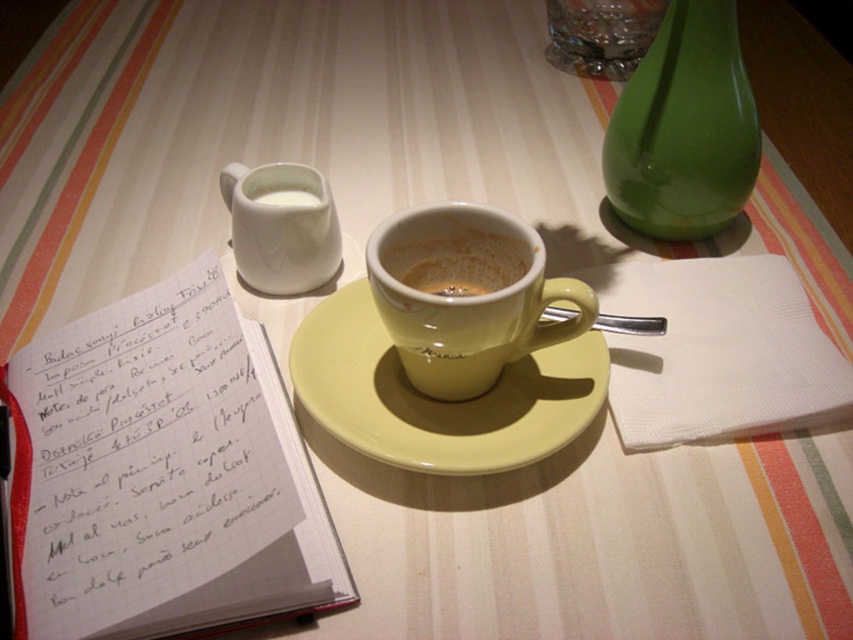
Is red cover notebook at left above white paper napkin at upper right?

Incorrect, red cover notebook at left is not positioned above white paper napkin at upper right.

Describe the element at coordinates (161, 474) in the screenshot. I see `red cover notebook at left` at that location.

Which is behind, point (230, 513) or point (799, 323)?

The point (799, 323) is more distant.

The width and height of the screenshot is (853, 640). I want to click on red cover notebook at left, so click(x=161, y=474).

This screenshot has height=640, width=853. Describe the element at coordinates (717, 352) in the screenshot. I see `white paper napkin at upper right` at that location.

Does white paper napkin at upper right appear on the left side of white matte creamer at upper left?

In fact, white paper napkin at upper right is to the right of white matte creamer at upper left.

Who is more distant from viewer, (675, 408) or (281, 195)?

The point (281, 195) is behind.

The height and width of the screenshot is (640, 853). I want to click on white paper napkin at upper right, so click(717, 352).

Which is above, yellow ceramic cup at center or white matte creamer at upper left?

Positioned higher is white matte creamer at upper left.

Who is more forward, (439, 236) or (311, 204)?

Positioned in front is point (439, 236).

Identify the location of yellow ceramic cup at center. (456, 259).